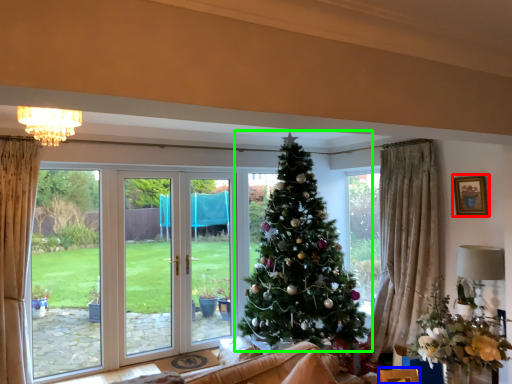
Question: Which object is the closest to the picture frame (highlighted by a red box)? Choose among these: furniture (highlighted by a blue box) or christmas tree (highlighted by a green box).

Choices:
 (A) furniture
 (B) christmas tree

Answer: (B)